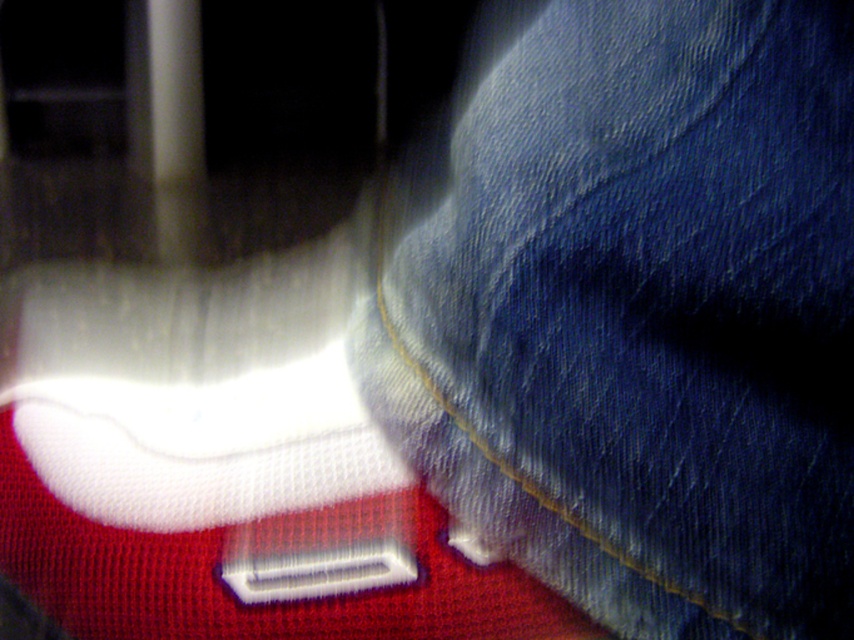
Question: Is denim at center above white mesh sock at lower left?

Choices:
 (A) no
 (B) yes

Answer: (B)

Question: Does denim at center appear over white mesh sock at lower left?

Choices:
 (A) yes
 (B) no

Answer: (A)

Question: Does denim at center appear under white mesh sock at lower left?

Choices:
 (A) no
 (B) yes

Answer: (A)

Question: Among these objects, which one is farthest from the camera?

Choices:
 (A) white mesh sock at lower left
 (B) denim at center

Answer: (A)